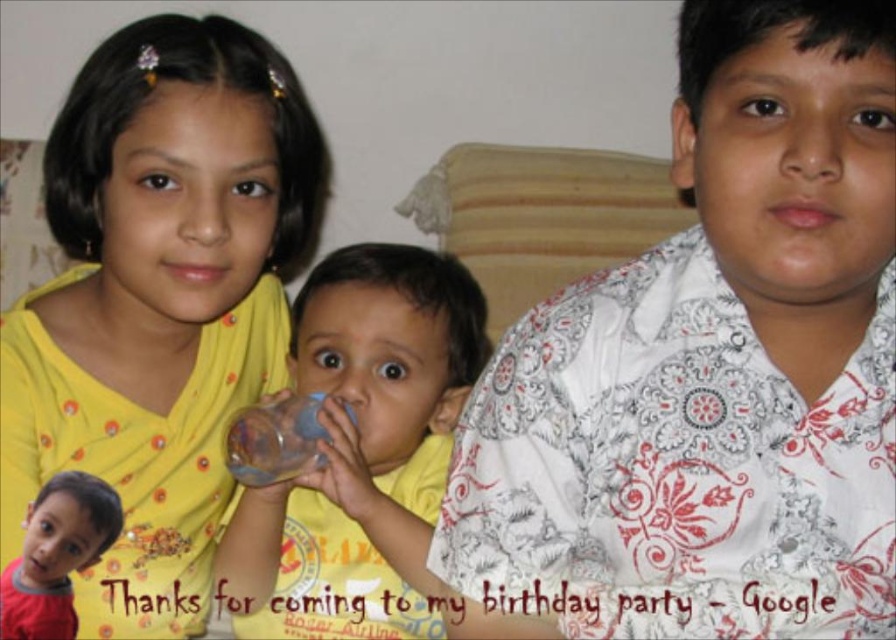
Looking at this image, does white printed shirt at center appear under yellow fabric at upper left?

Yes.

Which is in front, point (647, 342) or point (142, 232)?

Point (647, 342) is more forward.

This screenshot has width=896, height=640. I want to click on white printed shirt at center, so click(709, 371).

Who is more forward, (217, 500) or (274, 410)?

Positioned in front is point (274, 410).

Which is in front, point (164, 124) or point (274, 426)?

Point (164, 124) is in front.

Where is `yellow fabric at upper left`? This screenshot has width=896, height=640. yellow fabric at upper left is located at coordinates (159, 300).

Who is taller, yellow fabric at upper left or red cotton shirt at lower left?

yellow fabric at upper left

Does yellow fabric at upper left have a lesser width compared to red cotton shirt at lower left?

No.

Between point (136, 518) and point (37, 618), which one is positioned behind?

The point (136, 518) is more distant.

Where is `yellow fabric at upper left`? The image size is (896, 640). yellow fabric at upper left is located at coordinates (159, 300).